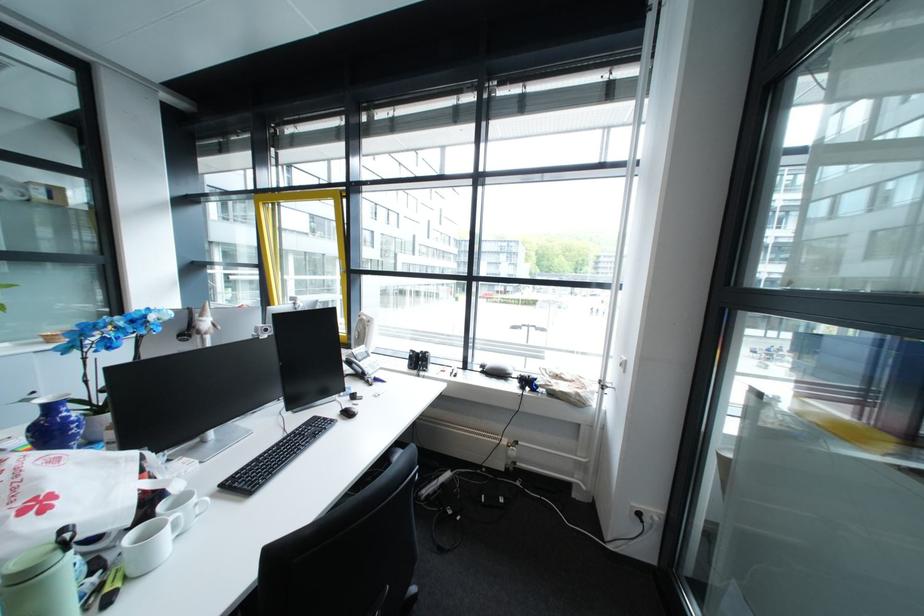
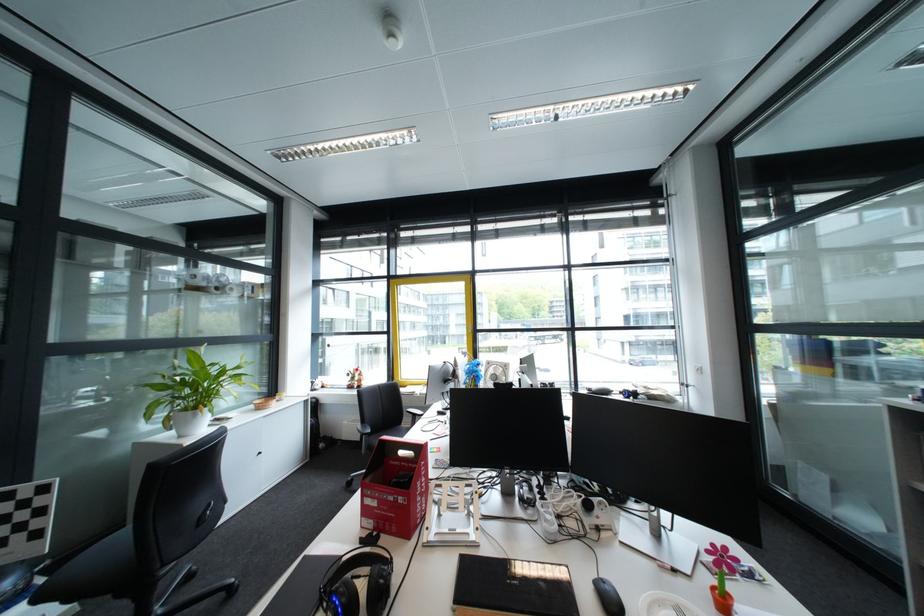
In a continuous first-person perspective shot, in which direction is the camera moving?

The cameraman walked toward left, backward.